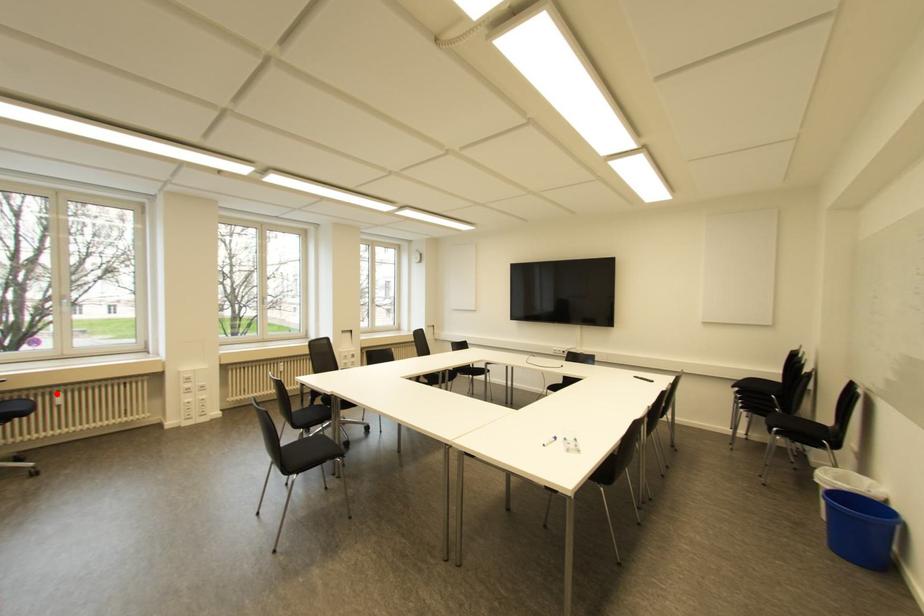
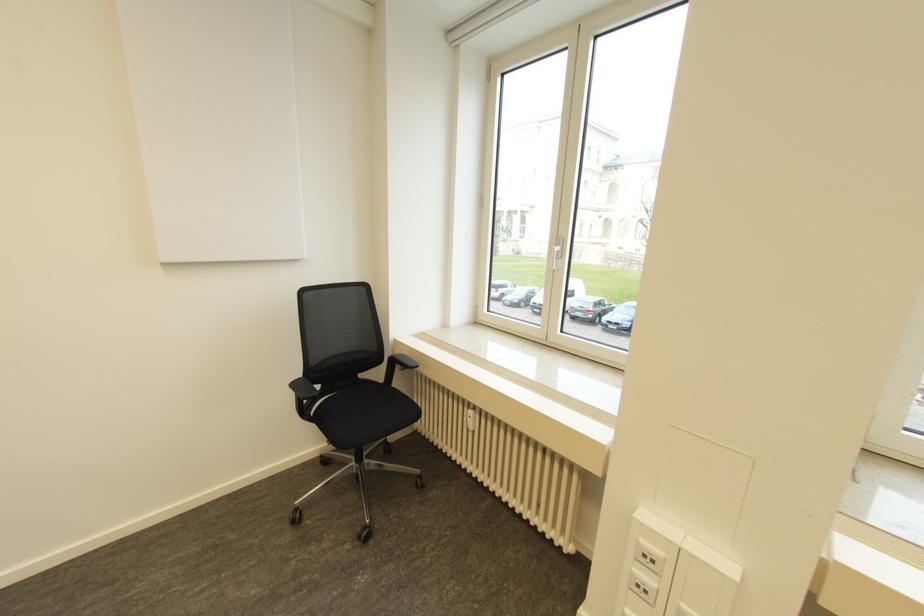
The point at the highlighted location is marked in the first image. Where is the corresponding point in the second image?

(469, 411)